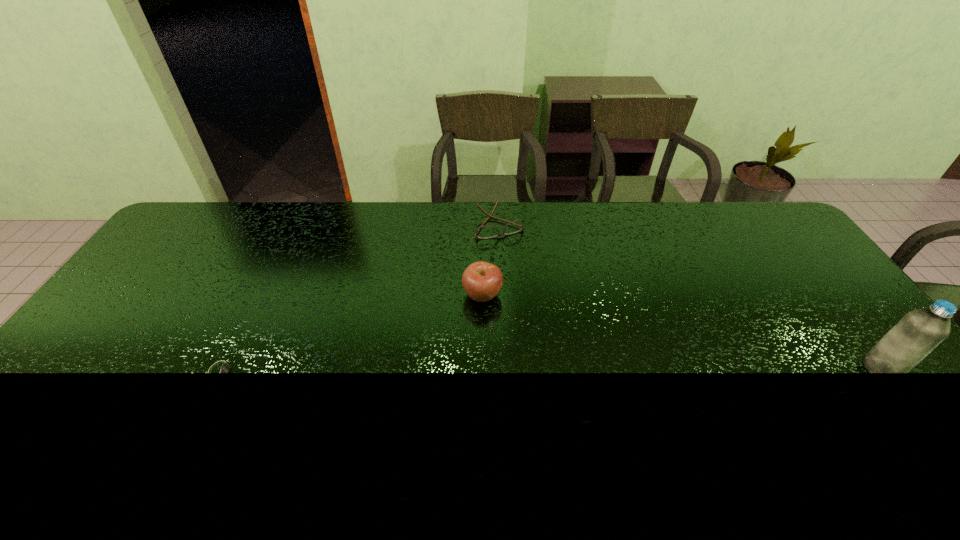
At what (x,y) coordinates should I click in order to perform the action: click on vacant position located on the side of the apple with the unique marking. Please return your answer as a coordinate pair (x, y). Looking at the image, I should click on (545, 353).

The height and width of the screenshot is (540, 960). I want to click on vacant space located on the side of the apple with the unique marking, so [540, 348].

Where is `vacant space situated on the side of the apple with the unique marking`? This screenshot has width=960, height=540. vacant space situated on the side of the apple with the unique marking is located at coordinates (573, 379).

Where is `vacant point located on the front-facing side of the spectacles`? vacant point located on the front-facing side of the spectacles is located at coordinates (535, 294).

I want to click on free space located on the front-facing side of the spectacles, so click(525, 274).

This screenshot has height=540, width=960. Identify the location of vacant position located 0.050m on the front-facing side of the spectacles. (512, 248).

The width and height of the screenshot is (960, 540). What are the coordinates of `object that is at the far edge` in the screenshot? It's located at pos(483,232).

Identify the location of object that is positioned at the near edge. (226, 362).

The width and height of the screenshot is (960, 540). Find the location of `object at the right edge`. object at the right edge is located at coordinates (920, 331).

In the image, there is a desktop. At what (x,y) coordinates should I click in order to perform the action: click on free space at the far edge. Please return your answer as a coordinate pair (x, y). Looking at the image, I should click on (x=624, y=219).